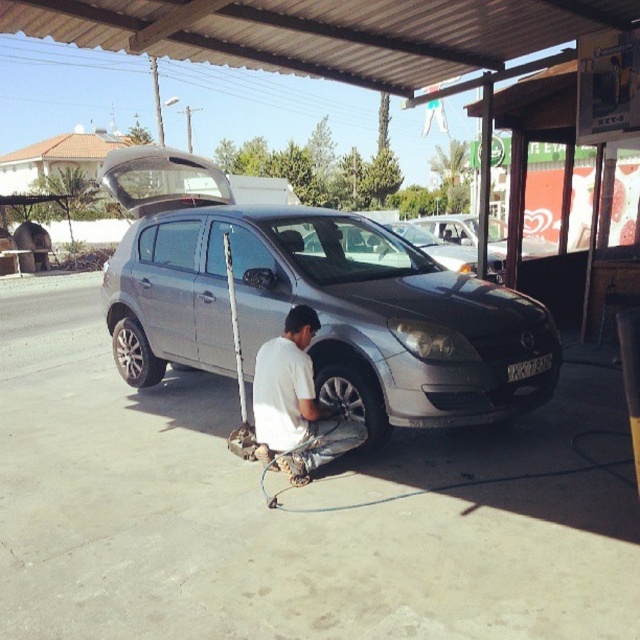
Question: Is satin silver car at center to the right of black rubber tire at lower center from the viewer's perspective?

Choices:
 (A) yes
 (B) no

Answer: (B)

Question: Can you confirm if white matte shirt at lower center is bigger than black rubber tire at lower center?

Choices:
 (A) no
 (B) yes

Answer: (B)

Question: Which is nearer to the white matte shirt at lower center?

Choices:
 (A) black plastic license plate at front
 (B) satin silver car at center
 (C) silver metallic tire at lower left
 (D) black rubber tire at lower center

Answer: (D)

Question: Is satin silver car at center positioned at the back of white matte shirt at lower center?

Choices:
 (A) no
 (B) yes

Answer: (B)

Question: Which object is closer to the camera taking this photo?

Choices:
 (A) black rubber tire at lower center
 (B) white matte shirt at lower center

Answer: (B)

Question: Among these points, which one is nearest to the camera?

Choices:
 (A) (509, 380)
 (B) (342, 404)
 (C) (304, 480)

Answer: (C)